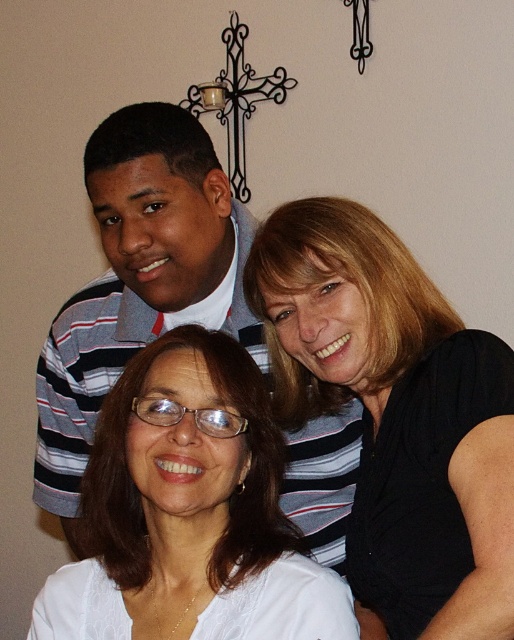
Question: Is black matte shirt at upper right behind white matte glasses at center?

Choices:
 (A) no
 (B) yes

Answer: (A)

Question: Can you confirm if black matte shirt at upper right is positioned below white matte glasses at center?

Choices:
 (A) no
 (B) yes

Answer: (A)

Question: Can you confirm if black matte shirt at upper right is positioned above white matte glasses at center?

Choices:
 (A) no
 (B) yes

Answer: (B)

Question: Which point is farther from the camera taking this photo?

Choices:
 (A) (308, 262)
 (B) (276, 488)

Answer: (B)